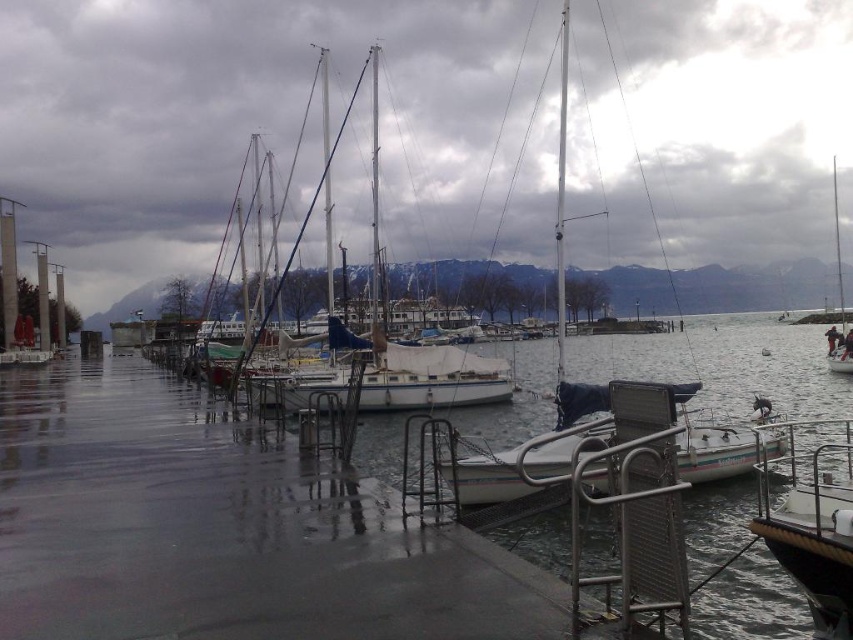
Question: Which point appears farthest from the camera in this image?

Choices:
 (A) (848, 442)
 (B) (184, 124)
 (C) (589, 388)
 (D) (200, 406)

Answer: (B)

Question: Can you confirm if white matte sailboat at center is wider than clear water at dock center?

Choices:
 (A) yes
 (B) no

Answer: (A)

Question: Is clear water at dock center bigger than white matte boat at center?

Choices:
 (A) no
 (B) yes

Answer: (B)

Question: Among these objects, which one is farthest from the camera?

Choices:
 (A) white sailboat at center
 (B) white matte boat at center

Answer: (B)

Question: Among these points, which one is farthest from the camera?

Choices:
 (A) (512, 465)
 (B) (4, 435)
 (C) (509, 464)
 (D) (802, 545)

Answer: (B)

Question: Does white matte sailboat at center have a lesser width compared to clear water at dock center?

Choices:
 (A) yes
 (B) no

Answer: (B)